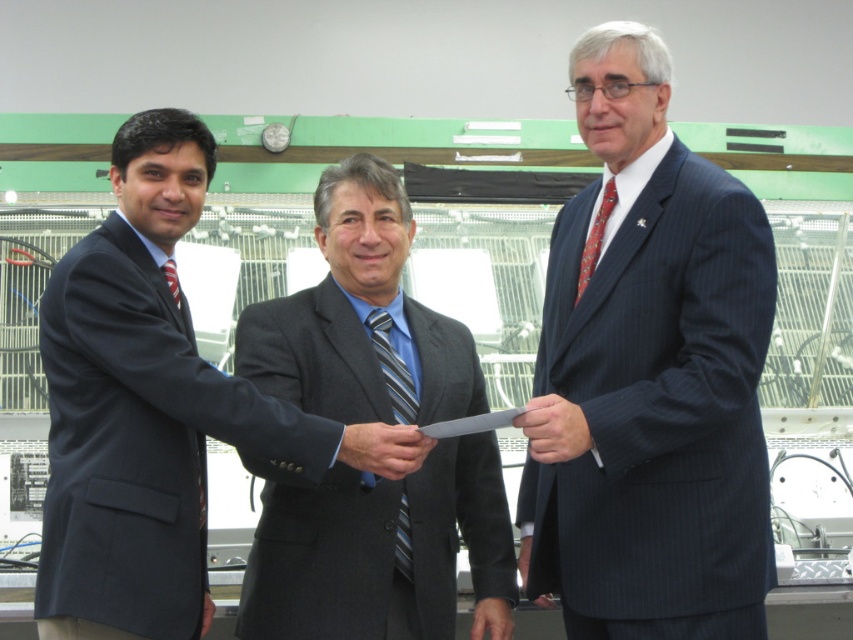
How far apart are the two men in the pinstriped suit at center and the other man?

The two men are 7.97 feet apart.